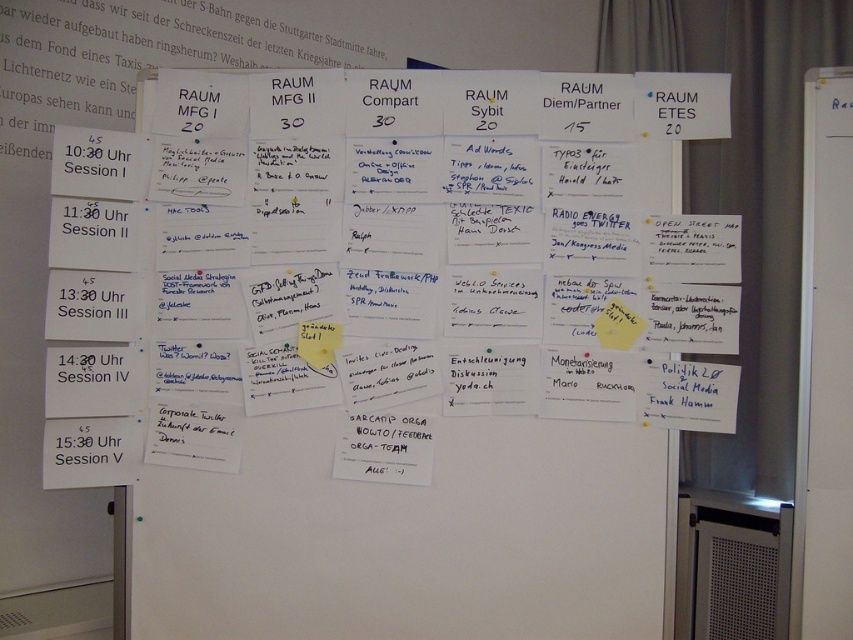
Question: Is white paperboard at right thinner than yellow sticky note at center?

Choices:
 (A) yes
 (B) no

Answer: (B)

Question: Estimate the real-world distances between objects in this image. Which object is closer to the yellow paper at center?

Choices:
 (A) white paperboard at right
 (B) yellow sticky note at center

Answer: (A)

Question: Which object is closer to the camera taking this photo?

Choices:
 (A) white paperboard at right
 (B) yellow sticky note at center

Answer: (A)

Question: Can you confirm if white paperboard at right is thinner than yellow sticky note at center?

Choices:
 (A) yes
 (B) no

Answer: (B)

Question: Does yellow paper at center appear under yellow sticky note at center?

Choices:
 (A) yes
 (B) no

Answer: (B)

Question: Which of the following is the closest to the observer?

Choices:
 (A) yellow paper at center
 (B) yellow sticky note at center

Answer: (A)